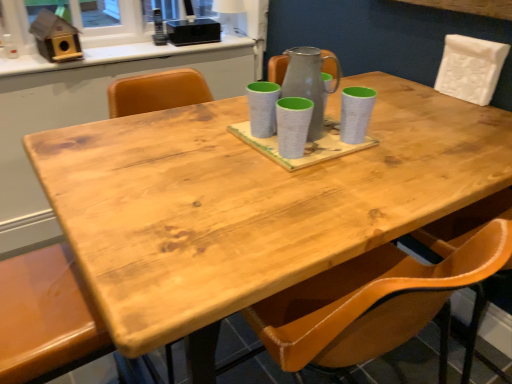
Identify the location of vacant space that is in between white matte chair at upper right, acting as the 2th chair starting from the bottom, and speckled white mug at center, the second mug viewed from the left. (417, 117).